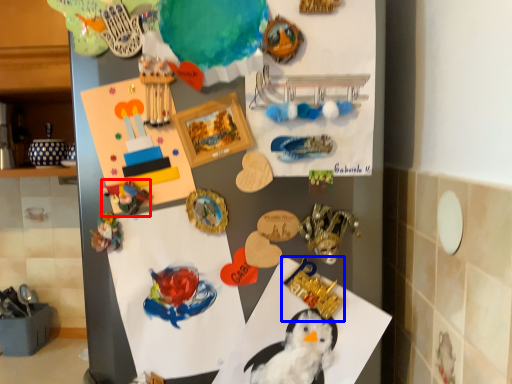
Question: Which point is closer to the camera, art (highlighted by a red box) or toy (highlighted by a blue box)?

Choices:
 (A) art
 (B) toy

Answer: (A)